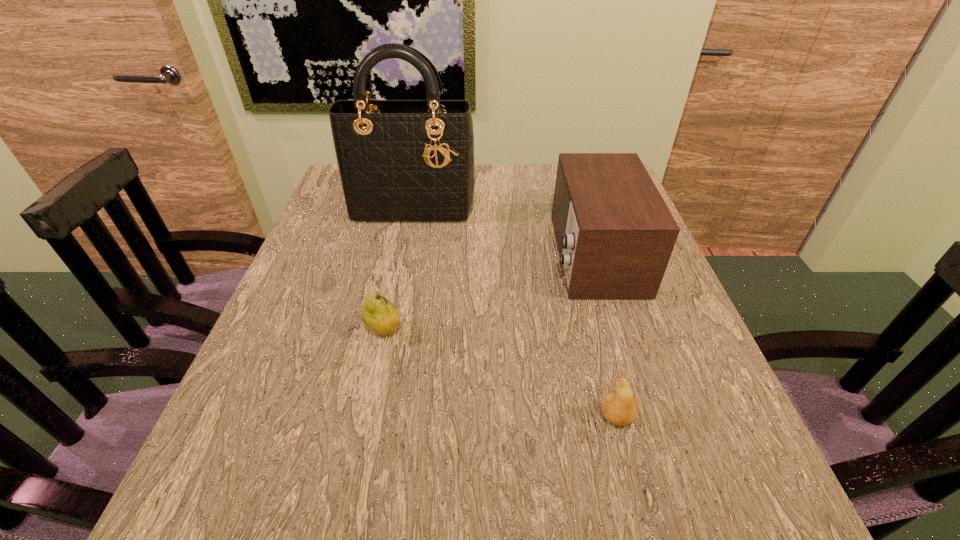
Find the location of a particular element. the tallest object is located at coordinates click(x=405, y=162).

The width and height of the screenshot is (960, 540). I want to click on the second tallest object, so click(x=615, y=235).

Locate an element on the screen. the third farthest object is located at coordinates (379, 314).

Identify the location of the farther pear. This screenshot has height=540, width=960. (379, 314).

At what (x,y) coordinates should I click in order to perform the action: click on the nearest object. Please return your answer as a coordinate pair (x, y). This screenshot has width=960, height=540. Looking at the image, I should click on (619, 407).

Where is `the right pear`? Image resolution: width=960 pixels, height=540 pixels. the right pear is located at coordinates (619, 407).

Locate an element on the screen. This screenshot has height=540, width=960. free region located 0.150m at the front of the handbag with visible charms is located at coordinates pos(401,262).

The image size is (960, 540). I want to click on blank space located on the front-facing side of the second tallest object, so click(456, 254).

Locate an element on the screen. Image resolution: width=960 pixels, height=540 pixels. blank area located 0.080m on the front-facing side of the second tallest object is located at coordinates (516, 254).

This screenshot has width=960, height=540. I want to click on vacant area located on the front-facing side of the second tallest object, so click(529, 254).